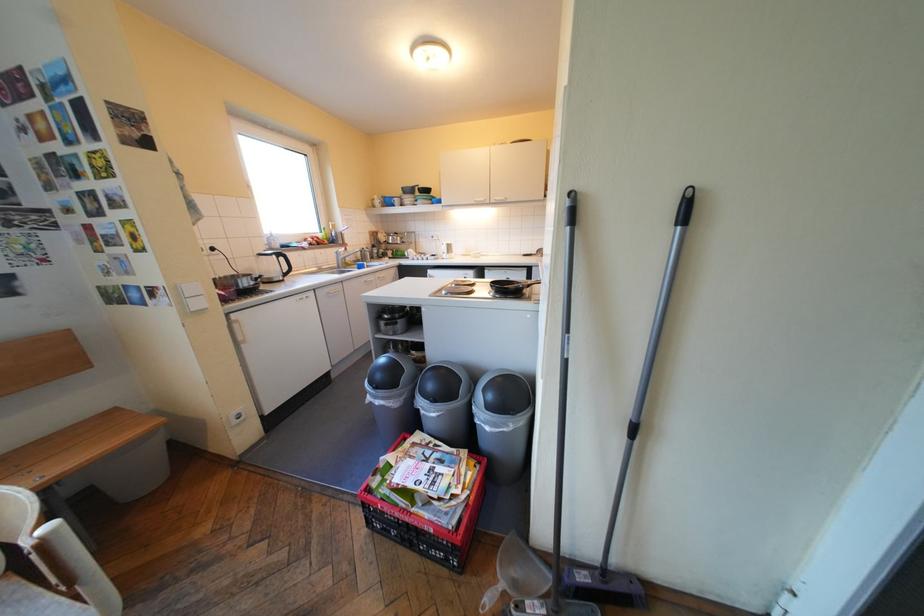
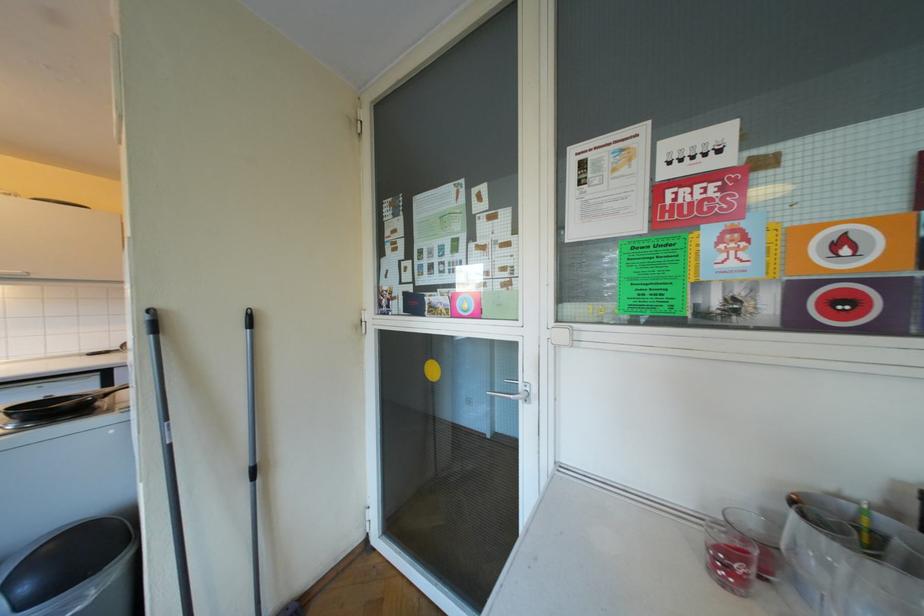
Find the pixel in the second image that matches (x=531, y=282) in the first image.

(95, 394)